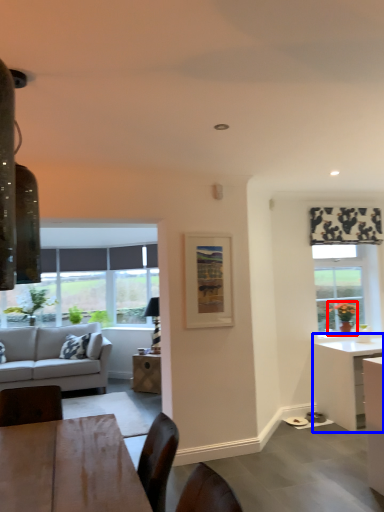
Question: Which object is further to the camera taking this photo, houseplant (highlighted by a red box) or desk (highlighted by a blue box)?

Choices:
 (A) houseplant
 (B) desk

Answer: (A)